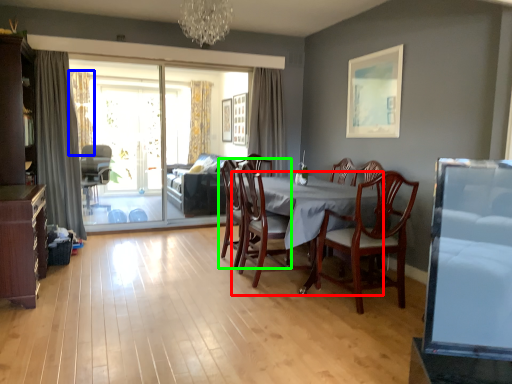
Question: Which object is the closest to the round table (highlighted by a red box)? Choose among these: curtain (highlighted by a blue box) or chair (highlighted by a green box).

Choices:
 (A) curtain
 (B) chair

Answer: (B)